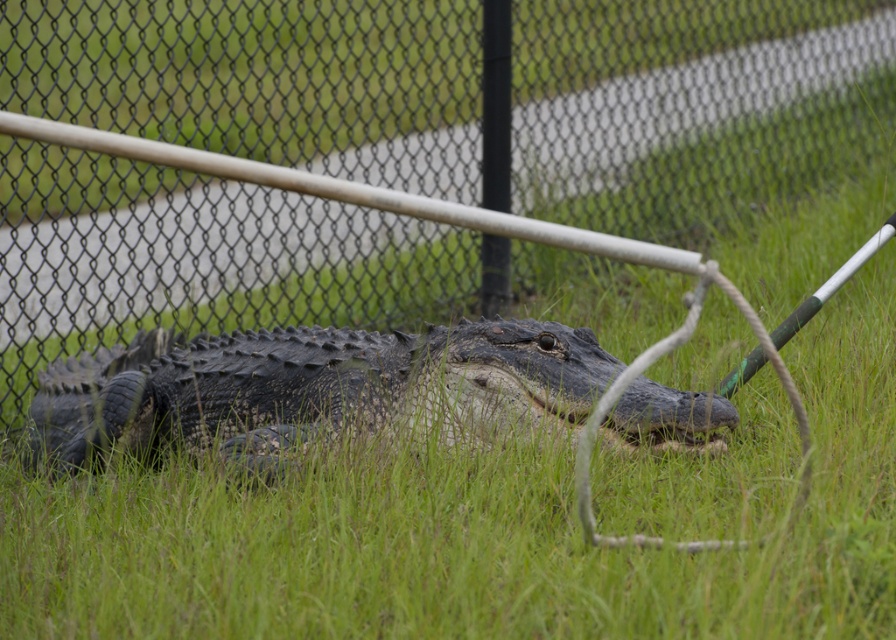
Question: Which point is closer to the camera?

Choices:
 (A) pos(148,289)
 (B) pos(332,340)

Answer: (B)

Question: In this image, where is black chain-link fence at center located relative to dark scaly crocodile at center?

Choices:
 (A) below
 (B) above

Answer: (B)

Question: Considering the relative positions of black chain-link fence at center and dark scaly crocodile at center in the image provided, where is black chain-link fence at center located with respect to dark scaly crocodile at center?

Choices:
 (A) above
 (B) below

Answer: (A)

Question: Is black chain-link fence at center positioned in front of dark scaly crocodile at center?

Choices:
 (A) yes
 (B) no

Answer: (B)

Question: Which point appears farthest from the camera in this image?

Choices:
 (A) (118, 49)
 (B) (257, 467)

Answer: (A)

Question: Which object is closer to the camera taking this photo?

Choices:
 (A) black chain-link fence at center
 (B) dark scaly crocodile at center

Answer: (B)